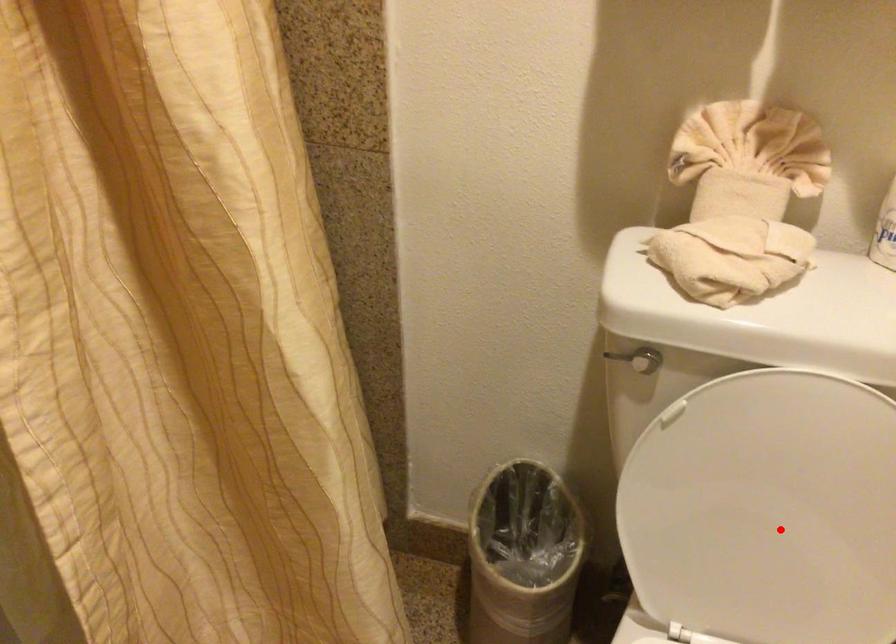
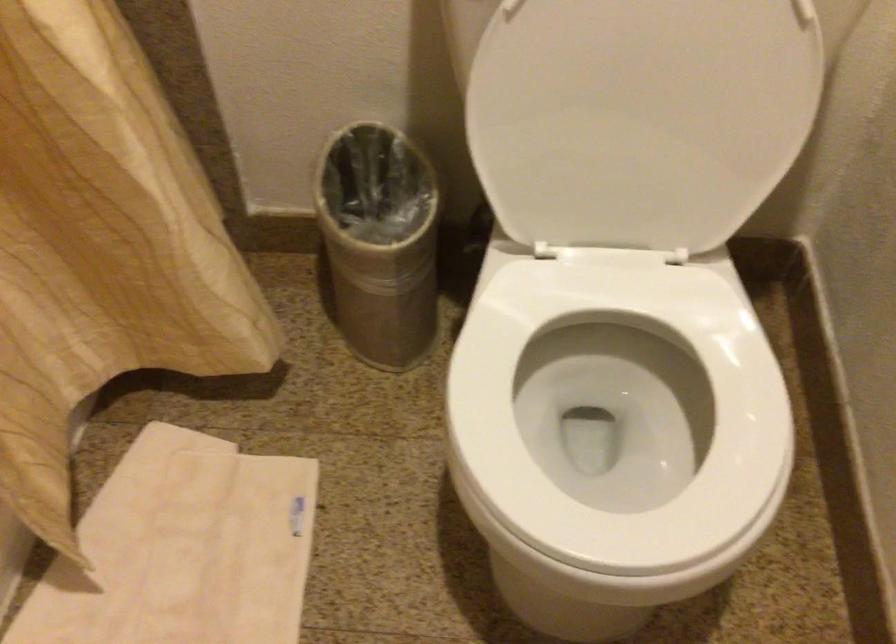
Where in the second image is the point corresponding to the highlighted location from the first image?

(640, 118)